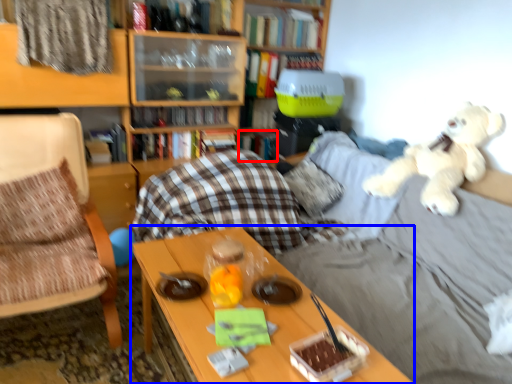
Question: Which object is closer to the camera taking this photo, book (highlighted by a red box) or table (highlighted by a blue box)?

Choices:
 (A) book
 (B) table

Answer: (B)